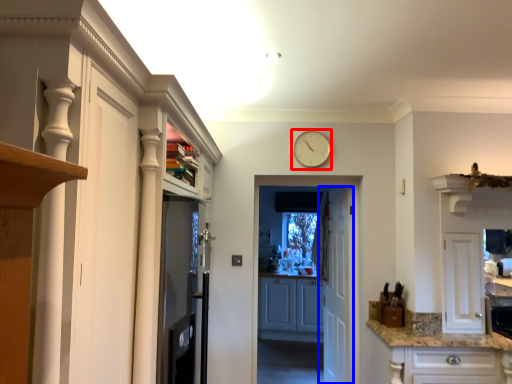
Question: Which object appears farthest to the camera in this image, clock (highlighted by a red box) or door (highlighted by a blue box)?

Choices:
 (A) clock
 (B) door

Answer: (B)